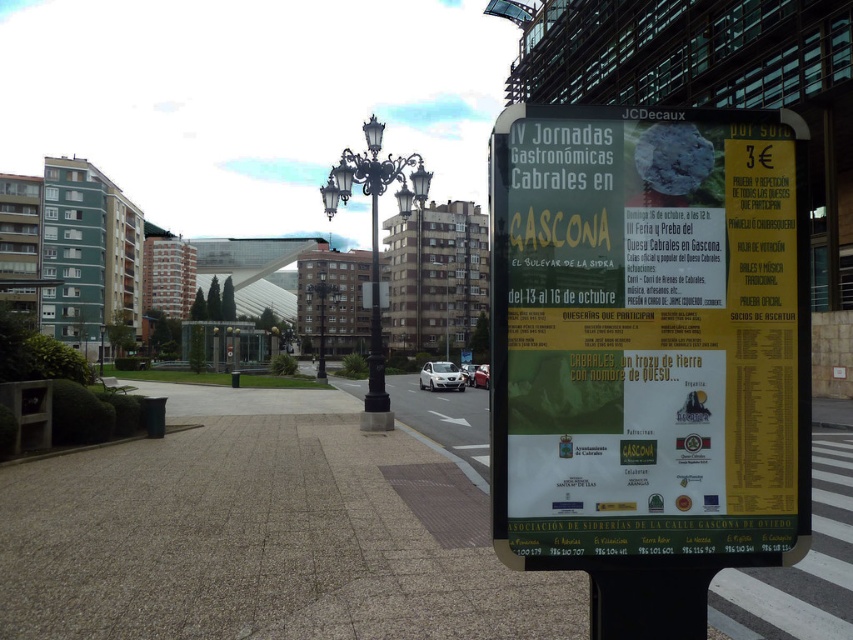
Can you confirm if white paper poster at right is positioned to the left of metallic street sign at center?

No, white paper poster at right is not to the left of metallic street sign at center.

Which is in front, point (637, 506) or point (329, 285)?

Point (637, 506) is more forward.

Find the location of `white paper poster at right`. white paper poster at right is located at coordinates point(648,337).

Between white paper poster at right and gray concrete pavement at center, which one appears on the left side from the viewer's perspective?

From the viewer's perspective, gray concrete pavement at center appears more on the left side.

Between point (770, 401) and point (786, 605), which one is positioned behind?

The point (786, 605) is behind.

Measure the distance between white paper poster at right and camera.

white paper poster at right is 2.53 meters from camera.

The image size is (853, 640). What are the coordinates of `white paper poster at right` in the screenshot? It's located at [648, 337].

What do you see at coordinates (264, 532) in the screenshot?
I see `gray concrete pavement at center` at bounding box center [264, 532].

Image resolution: width=853 pixels, height=640 pixels. What do you see at coordinates (264, 532) in the screenshot? I see `gray concrete pavement at center` at bounding box center [264, 532].

Identify the location of gray concrete pavement at center. This screenshot has height=640, width=853. (264, 532).